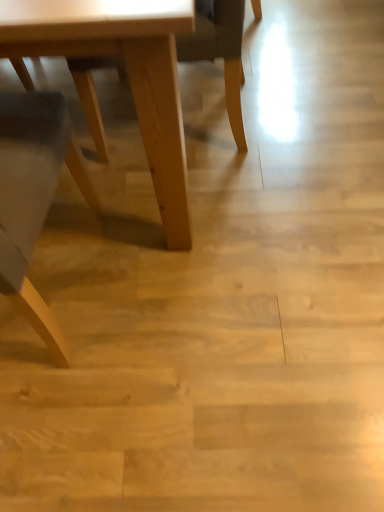
Find the location of a particular element. The width and height of the screenshot is (384, 512). unoccupied region to the right of light wood table at lower left is located at coordinates (235, 251).